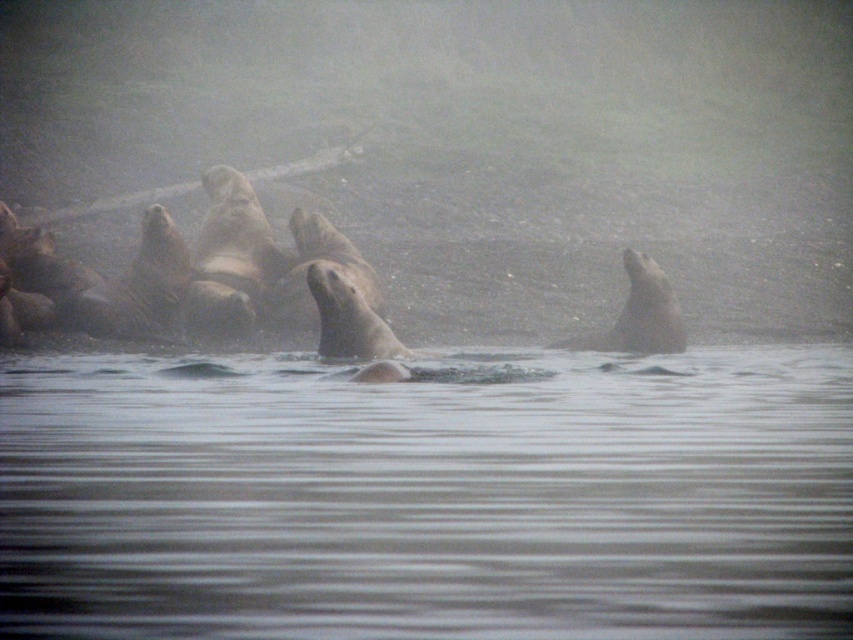
Question: Is gray fur seal at center to the right of smooth gray seal at right from the viewer's perspective?

Choices:
 (A) yes
 (B) no

Answer: (B)

Question: Does gray fur seal at center have a lesser width compared to brown fur seal at center?

Choices:
 (A) yes
 (B) no

Answer: (B)

Question: Which point is closer to the camera?

Choices:
 (A) brown fur seal at center
 (B) gray fur seal at center
 (C) smooth gray seal at right

Answer: (A)

Question: Which of these objects is positioned farthest from the smooth gray seal at right?

Choices:
 (A) gray fur seal at center
 (B) brown fur seal at center

Answer: (A)

Question: Which of the following is the farthest from the observer?

Choices:
 (A) brown fur seal at center
 (B) smooth gray seal at right
 (C) gray fur seal at center

Answer: (C)

Question: Does smooth gray seal at right appear on the right side of brown fur seal at center?

Choices:
 (A) no
 (B) yes

Answer: (B)